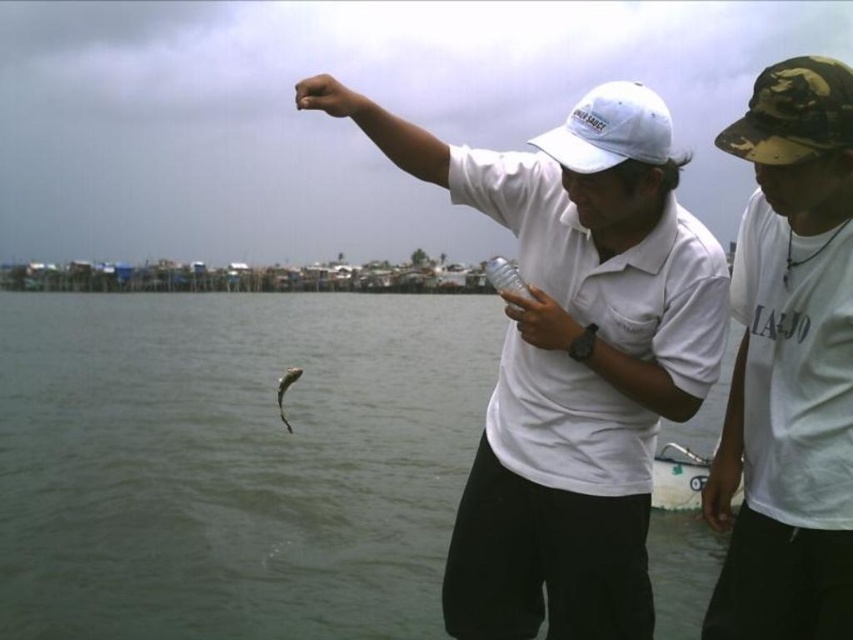
You are a photographer trying to capture both the camouflage fabric cap at upper right and the white matte baseball cap at center in the same frame. Which cap should you focus on first to ensure both are in the shot?

The camouflage fabric cap at upper right is thinner than the white matte baseball cap at center, so you should focus on the white matte baseball cap at center first to ensure both are in the shot.

You are a photographer standing at the edge of the water. You want to take a photo of the shiny silver fish at center without the white matte baseball cap at center appearing in the frame. Is this possible given their positions?

The white matte baseball cap at center is located above the shiny silver fish at center, so if you position your camera to focus on the fish while angling it downward, you can avoid capturing the cap in the frame.